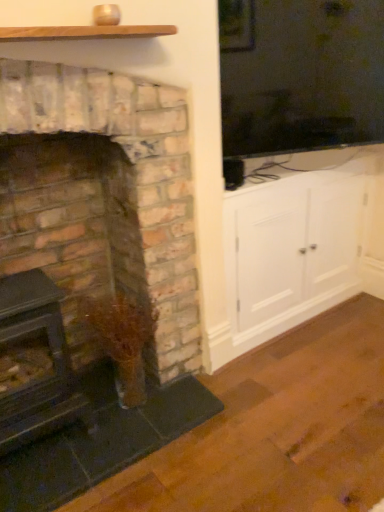
Question: Is rustic brick fireplace at left, the second fireplace in the left-to-right sequence, touching rustic brick fireplace at left, positioned as the 2th fireplace in right-to-left order?

Choices:
 (A) no
 (B) yes

Answer: (B)

Question: Considering the relative positions of rustic brick fireplace at left, placed as the 1th fireplace when sorted from right to left, and rustic brick fireplace at left, which appears as the 1th fireplace when viewed from the left, in the image provided, is rustic brick fireplace at left, placed as the 1th fireplace when sorted from right to left, in front of rustic brick fireplace at left, which appears as the 1th fireplace when viewed from the left,?

Choices:
 (A) yes
 (B) no

Answer: (A)

Question: Can you confirm if rustic brick fireplace at left, the second fireplace in the left-to-right sequence, is thinner than rustic brick fireplace at left, positioned as the 2th fireplace in right-to-left order?

Choices:
 (A) no
 (B) yes

Answer: (A)

Question: Are rustic brick fireplace at left, the second fireplace in the left-to-right sequence, and rustic brick fireplace at left, which appears as the 1th fireplace when viewed from the left, located far from each other?

Choices:
 (A) yes
 (B) no

Answer: (B)

Question: Is rustic brick fireplace at left, placed as the 1th fireplace when sorted from right to left, facing towards rustic brick fireplace at left, positioned as the 2th fireplace in right-to-left order?

Choices:
 (A) no
 (B) yes

Answer: (B)

Question: Is wooden plank at upper center inside the boundaries of rustic brick fireplace at left, the second fireplace in the left-to-right sequence, or outside?

Choices:
 (A) outside
 (B) inside

Answer: (A)

Question: From a real-world perspective, is wooden plank at upper center physically located above or below rustic brick fireplace at left, the second fireplace in the left-to-right sequence?

Choices:
 (A) above
 (B) below

Answer: (A)

Question: Considering the positions of wooden plank at upper center and rustic brick fireplace at left, the second fireplace in the left-to-right sequence, in the image, is wooden plank at upper center taller or shorter than rustic brick fireplace at left, the second fireplace in the left-to-right sequence,?

Choices:
 (A) short
 (B) tall

Answer: (A)

Question: Does point (0, 34) appear closer or farther from the camera than point (23, 243)?

Choices:
 (A) closer
 (B) farther

Answer: (A)

Question: Based on their sizes in the image, would you say wooden plank at upper center is bigger or smaller than rustic brick fireplace at left, which appears as the 1th fireplace when viewed from the left?

Choices:
 (A) big
 (B) small

Answer: (B)

Question: Does point (155, 28) appear closer or farther from the camera than point (72, 355)?

Choices:
 (A) farther
 (B) closer

Answer: (B)

Question: Visually, is wooden plank at upper center positioned to the left or to the right of rustic brick fireplace at left, which appears as the 1th fireplace when viewed from the left?

Choices:
 (A) right
 (B) left

Answer: (A)

Question: Looking at their shapes, would you say wooden plank at upper center is wider or thinner than rustic brick fireplace at left, positioned as the 2th fireplace in right-to-left order?

Choices:
 (A) wide
 (B) thin

Answer: (B)

Question: Considering the positions of white wood cabinet at right and wooden plank at upper center in the image, is white wood cabinet at right taller or shorter than wooden plank at upper center?

Choices:
 (A) short
 (B) tall

Answer: (B)

Question: From the image's perspective, is white wood cabinet at right located above or below wooden plank at upper center?

Choices:
 (A) above
 (B) below

Answer: (B)